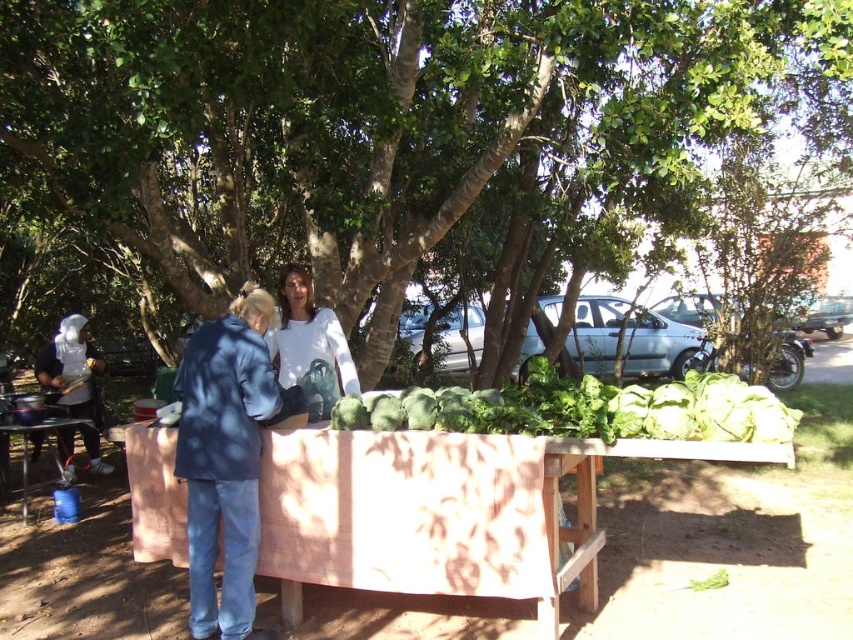
Which of these two, green leafy tree at center or blue plastic bucket at lower left, stands shorter?

Standing shorter between the two is blue plastic bucket at lower left.

Who is more forward, (351, 4) or (22, 524)?

Point (351, 4) is in front.

Where is `green leafy tree at center`? green leafy tree at center is located at coordinates [369, 115].

Is blue denim jacket at lower left above white matte shirt at center?

Incorrect, blue denim jacket at lower left is not positioned above white matte shirt at center.

Which of these two, blue denim jacket at lower left or white matte shirt at center, stands taller?

blue denim jacket at lower left is taller.

Describe the element at coordinates (225, 458) in the screenshot. I see `blue denim jacket at lower left` at that location.

You are a GUI agent. You are given a task and a screenshot of the screen. Output one action in this format:
    pyautogui.click(x=<x>, y=<y>)
    Task: Click on the blue denim jacket at lower left
    The width and height of the screenshot is (853, 640).
    Given the screenshot: What is the action you would take?
    pyautogui.click(x=225, y=458)

Between wooden table at center and blue denim jacket at lower left, which one has more height?

blue denim jacket at lower left is taller.

Is the position of wooden table at center less distant than that of blue denim jacket at lower left?

That is True.

Is point (506, 460) closer to camera compared to point (234, 525)?

Yes, point (506, 460) is closer to viewer.

Locate an element on the screen. Image resolution: width=853 pixels, height=640 pixels. wooden table at center is located at coordinates (445, 512).